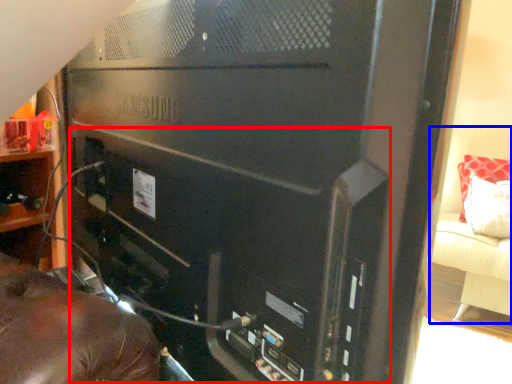
Question: Which object is further to the camera taking this photo, computer tower (highlighted by a red box) or furniture (highlighted by a blue box)?

Choices:
 (A) computer tower
 (B) furniture

Answer: (B)